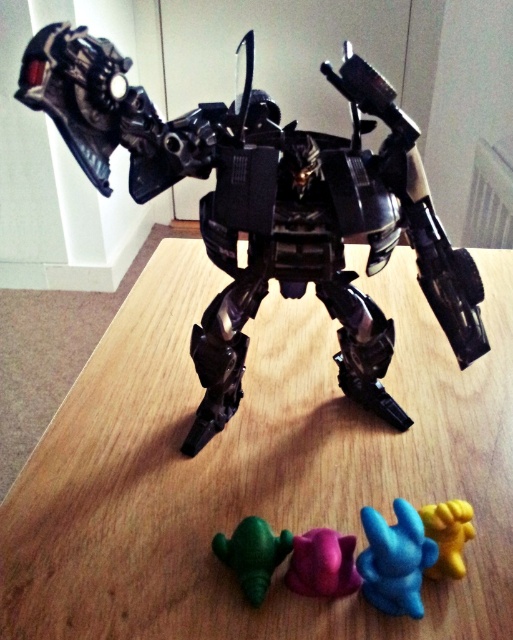
Based on the photo, you are a collector who wants to display the metallic black robot at center and the purple matte toy at lower center on a shelf. Given their sizes, which one should you place on the higher shelf to ensure both are visible?

The metallic black robot at center is much taller than the purple matte toy at lower center, so placing the metallic black robot at center on the higher shelf would ensure both are visible.

You are a collector organizing your shelf. You have a metallic black robot at center and a purple matte toy at lower center. According to the image, which object is positioned higher up?

The metallic black robot at center is located above the purple matte toy at lower center, so it is positioned higher up.

You are a collector who wants to place the purple matte toy at lower center on top of the metallic black robot at center. Is this possible based on their sizes?

The metallic black robot at center is larger in size than the purple matte toy at lower center, so it is possible to place the purple matte toy at lower center on top of the metallic black robot at center since the robot is bigger and provides enough space.